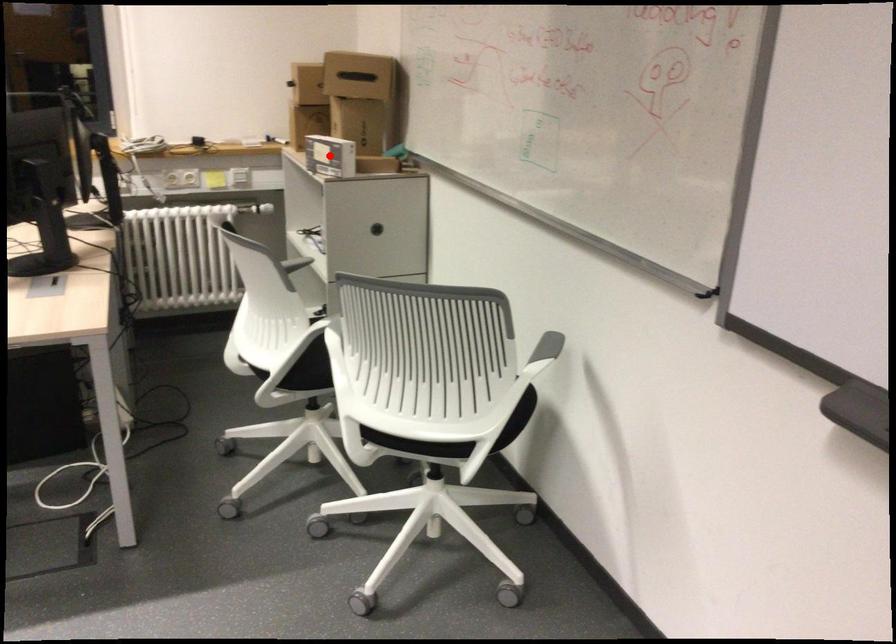
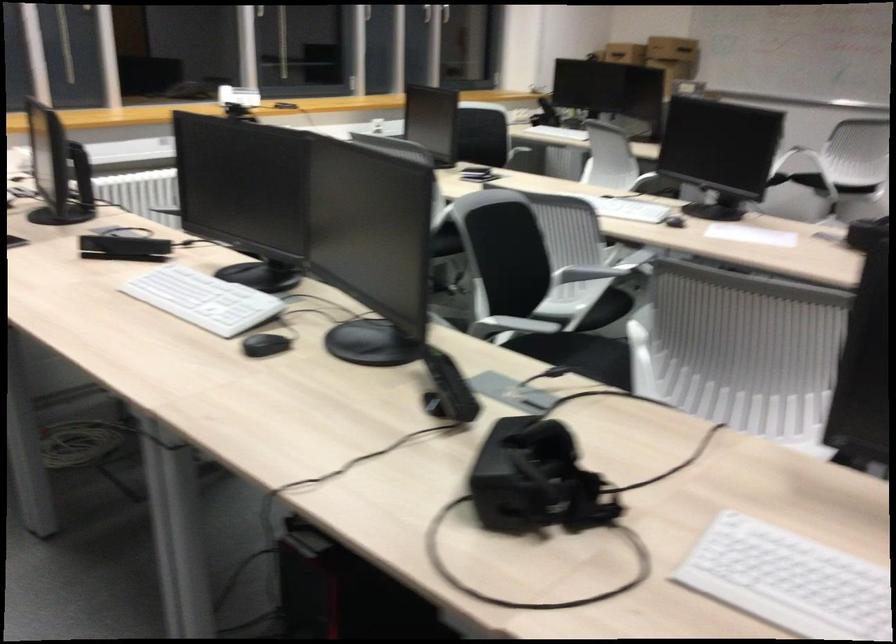
Question: I am providing you with two images of the same scene from different viewpoints. A red point is marked on the first image. Can you still see the location of the red point in image 2?

Choices:
 (A) Yes
 (B) No

Answer: (B)